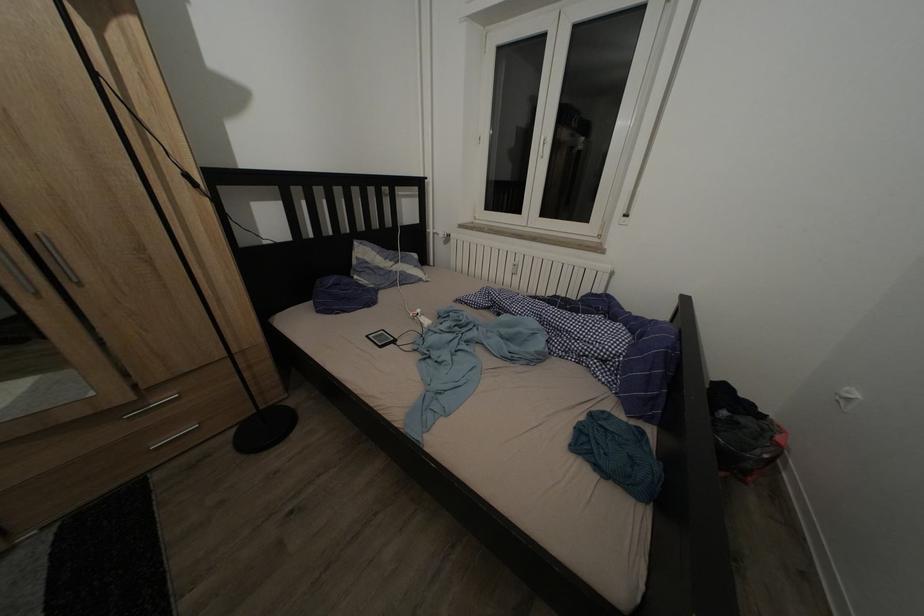
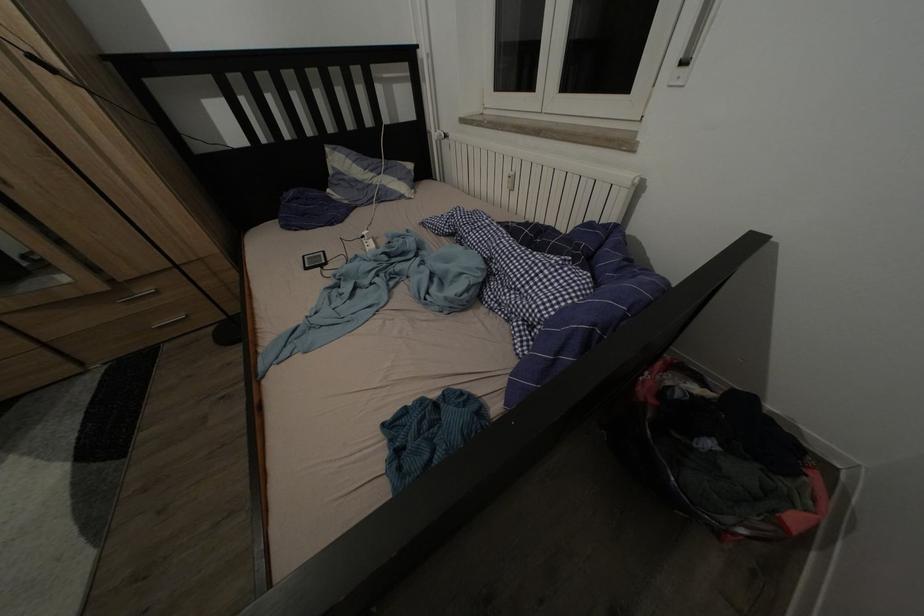
Where in the second image is the point corresponding to pixel 427 317 from the first image?

(372, 238)